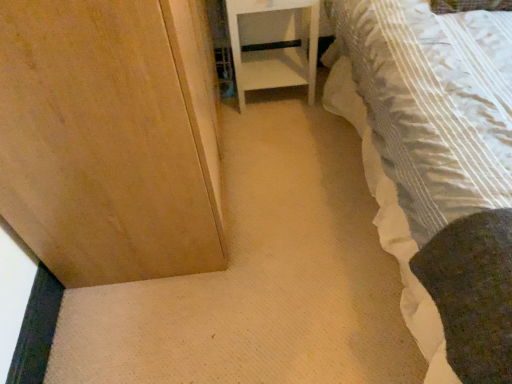
Find the location of a particular element. The image size is (512, 384). vacant region under white glossy nightstand at center (from a real-world perspective) is located at coordinates (275, 102).